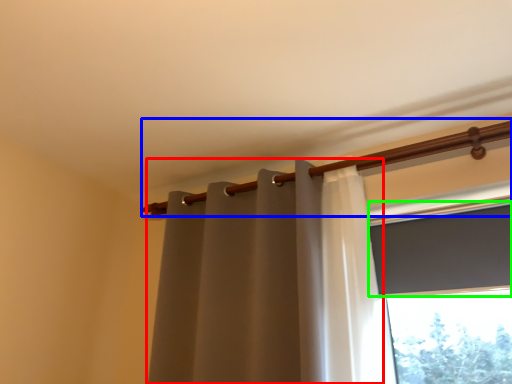
Question: Which object is the closest to the curtain (highlighted by a red box)? Choose among these: beam (highlighted by a blue box) or window screen (highlighted by a green box).

Choices:
 (A) beam
 (B) window screen

Answer: (A)